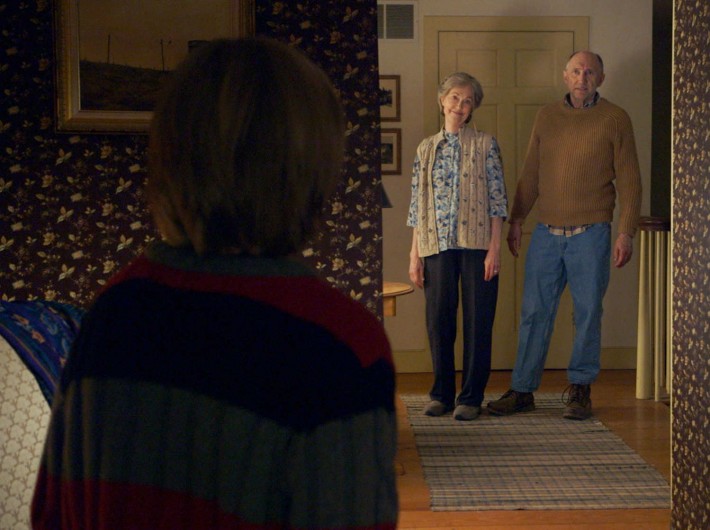
Identify the location of wooden floor. (484, 516).